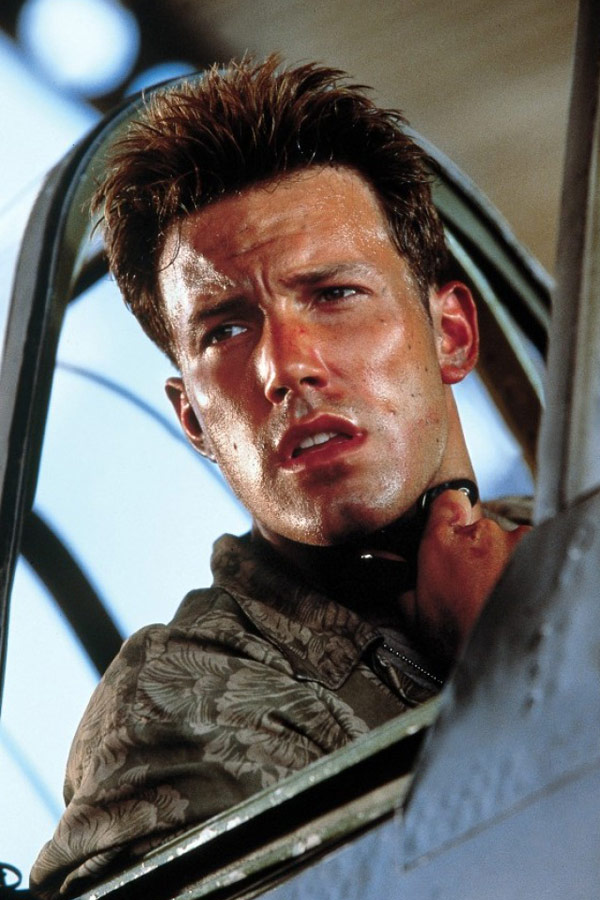
You are a GUI agent. You are given a task and a screenshot of the screen. Output one action in this format:
    pyautogui.click(x=<x>, y=<y>)
    Task: Click on the ceiling
    The image size is (600, 900).
    Given the screenshot: What is the action you would take?
    pyautogui.click(x=453, y=51)